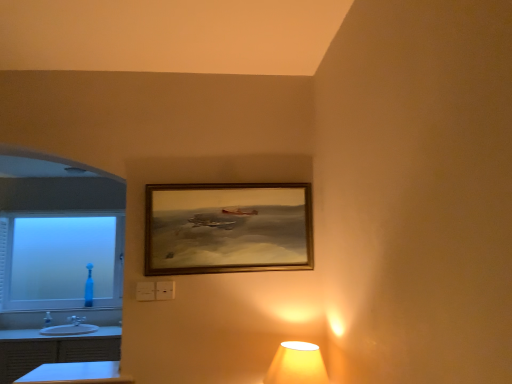
Question: From the image's perspective, is white glossy sink at lower left below wooden frame at center?

Choices:
 (A) yes
 (B) no

Answer: (A)

Question: Considering the relative positions of white glossy sink at lower left and wooden frame at center in the image provided, is white glossy sink at lower left behind wooden frame at center?

Choices:
 (A) no
 (B) yes

Answer: (B)

Question: Can you confirm if white glossy sink at lower left is shorter than wooden frame at center?

Choices:
 (A) yes
 (B) no

Answer: (A)

Question: Is white glossy sink at lower left thinner than wooden frame at center?

Choices:
 (A) yes
 (B) no

Answer: (B)

Question: From a real-world perspective, is white glossy sink at lower left under wooden frame at center?

Choices:
 (A) no
 (B) yes

Answer: (B)

Question: Is white glossy dresser at lower left in front of or behind white glossy sink at lower left in the image?

Choices:
 (A) front
 (B) behind

Answer: (A)

Question: From a real-world perspective, is white glossy dresser at lower left positioned above or below white glossy sink at lower left?

Choices:
 (A) below
 (B) above

Answer: (A)

Question: Looking at the image, does white glossy dresser at lower left seem bigger or smaller compared to white glossy sink at lower left?

Choices:
 (A) big
 (B) small

Answer: (A)

Question: Is white glossy dresser at lower left wider or thinner than white glossy sink at lower left?

Choices:
 (A) thin
 (B) wide

Answer: (B)

Question: In the image, is blue glossy table at lower left on the left side or the right side of frosted glass window at left?

Choices:
 (A) right
 (B) left

Answer: (A)

Question: Would you say blue glossy table at lower left is inside or outside frosted glass window at left?

Choices:
 (A) outside
 (B) inside

Answer: (A)

Question: From a real-world perspective, is blue glossy table at lower left above or below frosted glass window at left?

Choices:
 (A) above
 (B) below

Answer: (B)

Question: Is point (101, 362) closer or farther from the camera than point (0, 246)?

Choices:
 (A) farther
 (B) closer

Answer: (B)

Question: Is white glossy dresser at lower left spatially inside blue glass bottle at lower left, or outside of it?

Choices:
 (A) outside
 (B) inside

Answer: (A)

Question: From their relative heights in the image, would you say white glossy dresser at lower left is taller or shorter than blue glass bottle at lower left?

Choices:
 (A) short
 (B) tall

Answer: (B)